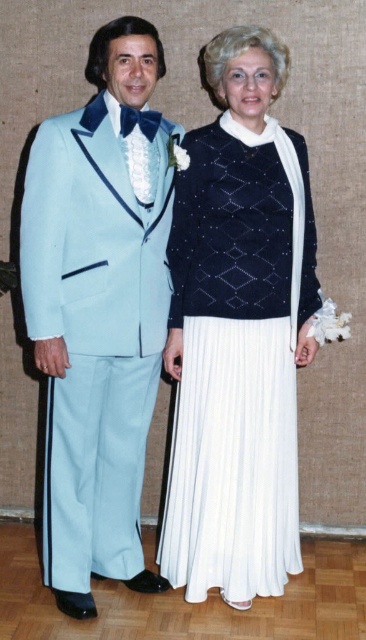
You are a photographer setting up for a group photo. You need to ensure that the light blue satin tuxedo at left and the white pleated skirt at center are both visible in the frame. Based on their heights, which one might you need to adjust the camera angle for to ensure both are fully visible?

The light blue satin tuxedo at left is taller than the white pleated skirt at center, so you might need to lower the camera angle slightly to ensure the taller tuxedo is fully visible while still capturing the shorter skirt in the frame.

You are a photographer at a formal event. You need to capture a photo where both the light blue satin tuxedo at left and the white pleated skirt at center are in focus. Since you can only focus on one subject at a time, which one should you focus on to ensure the other is also in focus?

You should focus on the light blue satin tuxedo at left because it is closer to the viewer than the white pleated skirt at center, so focusing on the closer subject will help keep both in focus.

You are a photographer at a formal event. You need to capture a closeup shot of both the light blue satin tuxedo at left and the white pleated skirt at center. Given that your camera can only focus on objects within a 10 inch range, will you be able to capture both in focus?

The light blue satin tuxedo at left and white pleated skirt at center are 11.24 inches apart, which exceeds the camera focus range of 10 inches. Therefore, both cannot be in focus simultaneously.